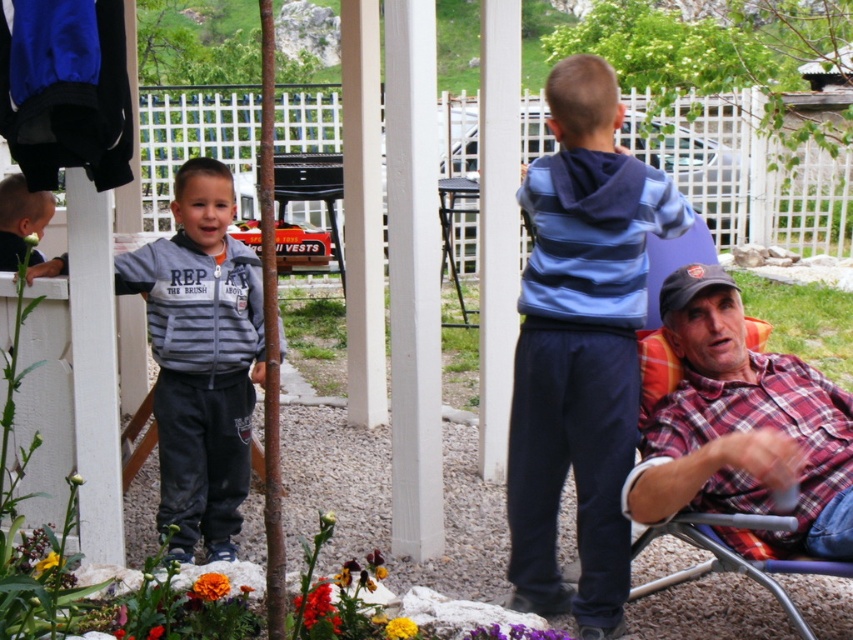
You are a gardener who wants to plant a new flower between the bright orange petals at lower center and the bright orange petal at center. The flower requires a space of 18 inches between them. Can you plant it there?

The distance between the bright orange petals at lower center and the bright orange petal at center is 17.28 inches, which is less than the required 18 inches. Therefore, you cannot plant the flower there.

You are standing at the point marked as point (x=317, y=612) in the image. Looking around, you see bright orange petals at lower center. What is directly beneath your feet?

The point (x=317, y=612) is on bright orange petals at lower center, so the bright orange petals at lower center are directly beneath your feet.

You are a gardener trying to plant a new flower in the garden. You have two options for placement based on the existing flowers. The bright orange petals at lower center and the bright orange petal at center. Which location has wider petals to ensure the new plant will have enough space to grow?

The bright orange petals at lower center have a greater width than the bright orange petal at center, so planting the new flower there would provide more space for growth.